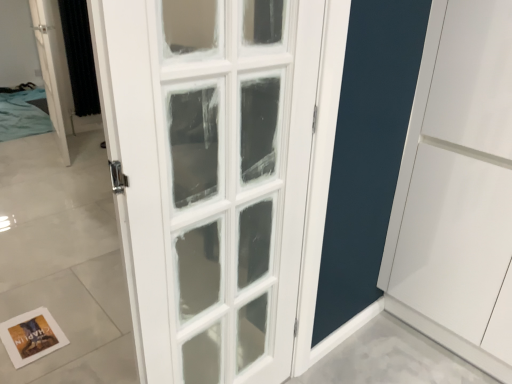
Locate an element on the screen. vacant region under white paper postcard at lower left (from a real-world perspective) is located at coordinates (28, 342).